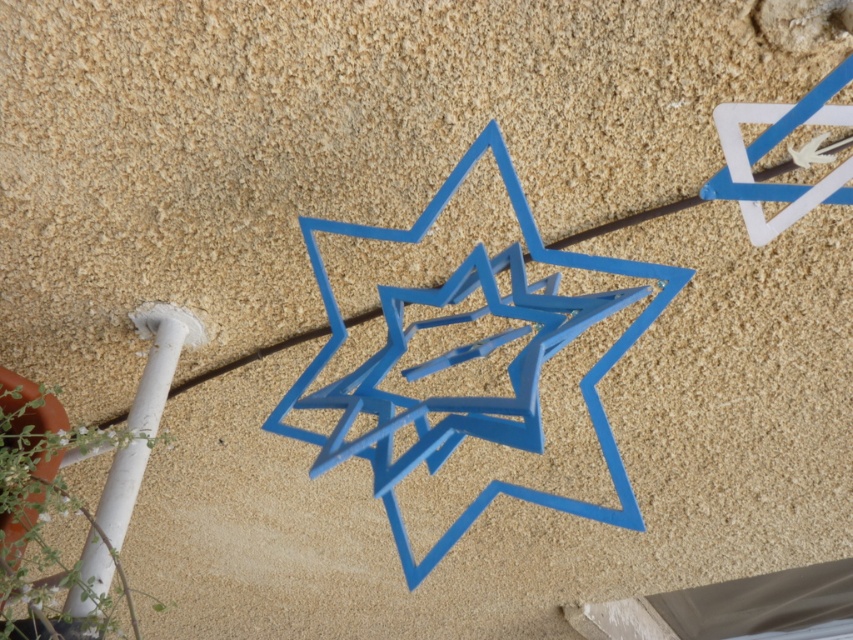
Who is positioned more to the left, blue matte star at center or blue matte star at upper right?

blue matte star at center

Image resolution: width=853 pixels, height=640 pixels. What do you see at coordinates (469, 358) in the screenshot?
I see `blue matte star at center` at bounding box center [469, 358].

The height and width of the screenshot is (640, 853). Find the location of `blue matte star at center`. blue matte star at center is located at coordinates (469, 358).

Find the location of `blue matte star at center`. blue matte star at center is located at coordinates (469, 358).

In the scene shown: Is blue matte star at center behind white matte pole at lower left?

That is False.

In order to click on blue matte star at center in this screenshot , I will do `click(469, 358)`.

I want to click on blue matte star at center, so click(469, 358).

Who is positioned more to the left, white matte pole at lower left or blue matte star at upper right?

From the viewer's perspective, white matte pole at lower left appears more on the left side.

Who is positioned more to the right, white matte pole at lower left or blue matte star at upper right?

blue matte star at upper right is more to the right.

You are a GUI agent. You are given a task and a screenshot of the screen. Output one action in this format:
    pyautogui.click(x=<x>, y=<y>)
    Task: Click on the white matte pole at lower left
    
    Given the screenshot: What is the action you would take?
    pyautogui.click(x=160, y=358)

Locate an element on the screen. The width and height of the screenshot is (853, 640). white matte pole at lower left is located at coordinates (160, 358).